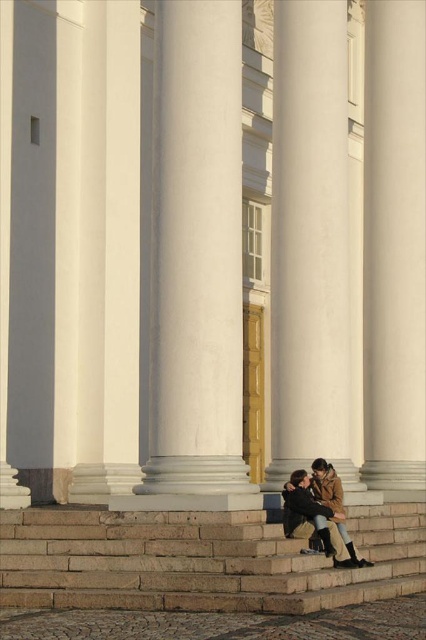
Can you confirm if white marble column at center is positioned to the left of white smooth column at center?

Indeed, white marble column at center is positioned on the left side of white smooth column at center.

Does point (176, 378) lie behind point (342, 296)?

No.

Is point (178, 176) positioned in front of point (339, 380)?

Yes, it is in front of point (339, 380).

Locate an element on the screen. Image resolution: width=426 pixels, height=640 pixels. white marble column at center is located at coordinates (195, 253).

Which is below, white marble column at center or brown leather jacket at lower center?

brown leather jacket at lower center

Can you confirm if white marble column at center is taller than brown leather jacket at lower center?

Yes, white marble column at center is taller than brown leather jacket at lower center.

Is point (233, 458) in front of point (342, 554)?

Yes, point (233, 458) is in front of point (342, 554).

Find the location of a particular element. This screenshot has width=426, height=640. white marble column at center is located at coordinates click(x=195, y=253).

Does white smooth column at center have a lesser width compared to brown leather jacket at lower center?

No, white smooth column at center is not thinner than brown leather jacket at lower center.

Which is in front, point (313, 48) or point (310, 508)?

Point (310, 508) is in front.

The height and width of the screenshot is (640, 426). In order to click on white smooth column at center in this screenshot , I will do `click(310, 241)`.